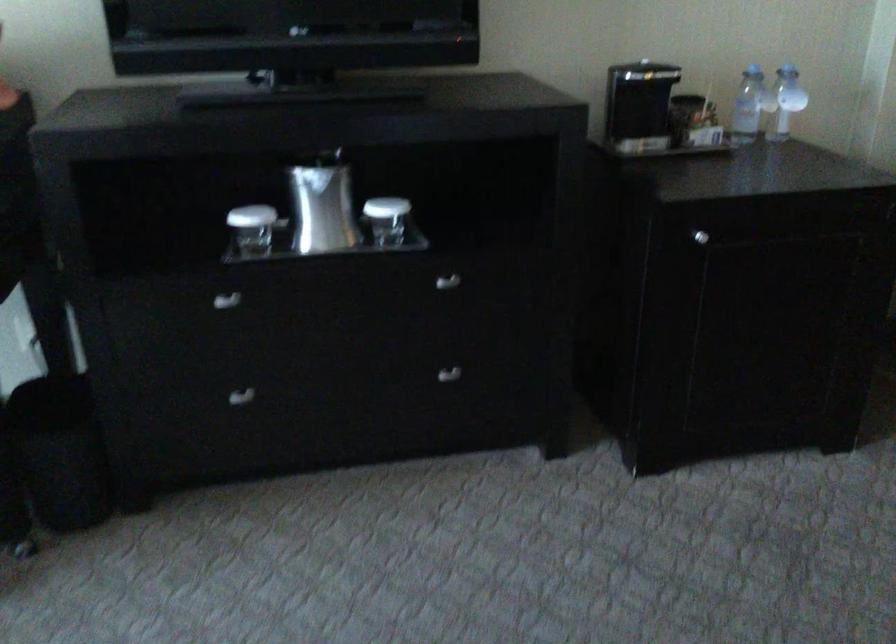
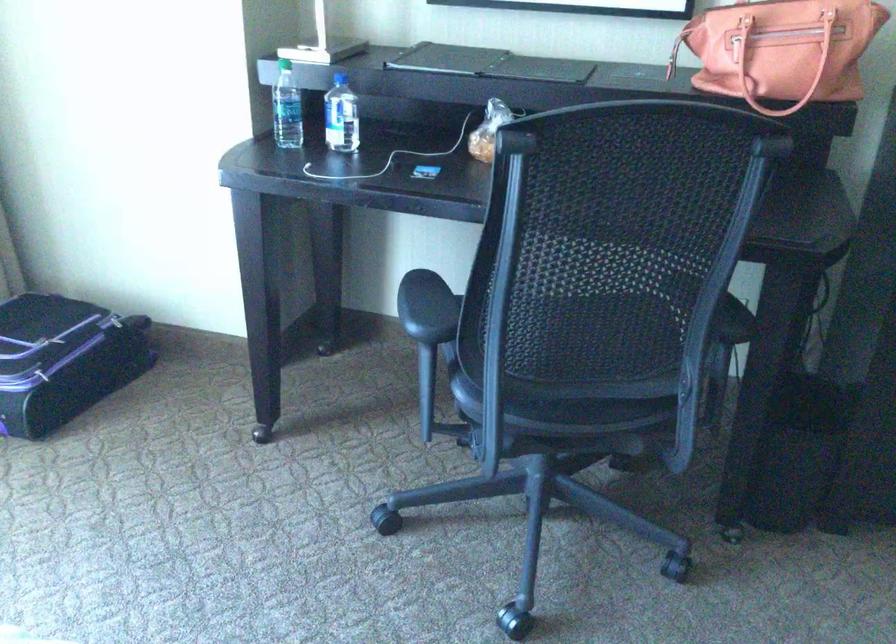
Question: What movement of the cameraman would produce the second image?

Choices:
 (A) Left
 (B) Right
 (C) Forward
 (D) Backward

Answer: (A)